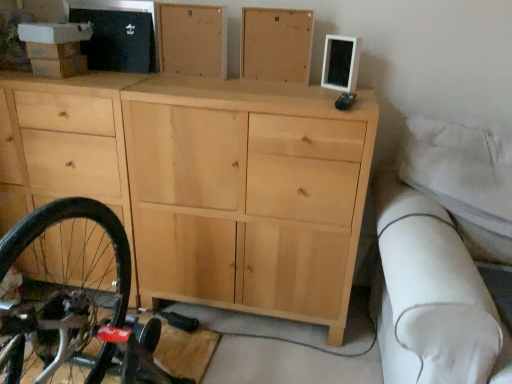
Question: Does natural wood cabinet at upper center, which is the second chest of drawer from right to left, appear on the right side of natural wood cabinet at upper center, which is counted as the 1th chest of drawer, starting from the right?

Choices:
 (A) no
 (B) yes

Answer: (A)

Question: Does natural wood cabinet at upper center, which ranks as the first chest of drawer in left-to-right order, have a greater height compared to natural wood cabinet at upper center, which is the second chest of drawer in left-to-right order?

Choices:
 (A) no
 (B) yes

Answer: (A)

Question: From a real-world perspective, is natural wood cabinet at upper center, which ranks as the first chest of drawer in left-to-right order, positioned under natural wood cabinet at upper center, which is the second chest of drawer in left-to-right order, based on gravity?

Choices:
 (A) yes
 (B) no

Answer: (B)

Question: Considering the relative sizes of natural wood cabinet at upper center, which is the second chest of drawer from right to left, and natural wood cabinet at upper center, which is counted as the 1th chest of drawer, starting from the right, in the image provided, is natural wood cabinet at upper center, which is the second chest of drawer from right to left, shorter than natural wood cabinet at upper center, which is counted as the 1th chest of drawer, starting from the right,?

Choices:
 (A) no
 (B) yes

Answer: (B)

Question: Is natural wood cabinet at upper center, which is the second chest of drawer from right to left, facing away from natural wood cabinet at upper center, which is the second chest of drawer in left-to-right order?

Choices:
 (A) no
 (B) yes

Answer: (A)

Question: Is natural wood cabinet at center wider or thinner than natural wood cabinet at upper center, which is the second chest of drawer from right to left?

Choices:
 (A) thin
 (B) wide

Answer: (B)

Question: From their relative heights in the image, would you say natural wood cabinet at center is taller or shorter than natural wood cabinet at upper center, which is the second chest of drawer from right to left?

Choices:
 (A) short
 (B) tall

Answer: (B)

Question: Is natural wood cabinet at center in front of or behind natural wood cabinet at upper center, which ranks as the first chest of drawer in left-to-right order, in the image?

Choices:
 (A) front
 (B) behind

Answer: (A)

Question: From the image's perspective, is natural wood cabinet at center positioned above or below natural wood cabinet at upper center, which ranks as the first chest of drawer in left-to-right order?

Choices:
 (A) below
 (B) above

Answer: (A)

Question: Considering the positions of natural wood cabinet at upper center, which ranks as the first chest of drawer in left-to-right order, and natural wood cabinet at center in the image, is natural wood cabinet at upper center, which ranks as the first chest of drawer in left-to-right order, wider or thinner than natural wood cabinet at center?

Choices:
 (A) wide
 (B) thin

Answer: (B)

Question: Based on their sizes in the image, would you say natural wood cabinet at upper center, which ranks as the first chest of drawer in left-to-right order, is bigger or smaller than natural wood cabinet at center?

Choices:
 (A) small
 (B) big

Answer: (A)

Question: Does point (192, 54) appear closer or farther from the camera than point (8, 129)?

Choices:
 (A) farther
 (B) closer

Answer: (A)

Question: From the image's perspective, relative to natural wood cabinet at center, is natural wood cabinet at upper center, which is the second chest of drawer from right to left, above or below?

Choices:
 (A) below
 (B) above

Answer: (B)

Question: Do you think natural wood cabinet at upper center, which is counted as the 1th chest of drawer, starting from the right, is within natural wood cabinet at upper center, which is the second chest of drawer from right to left, or outside of it?

Choices:
 (A) inside
 (B) outside

Answer: (B)

Question: From a real-world perspective, is natural wood cabinet at upper center, which is counted as the 1th chest of drawer, starting from the right, physically located above or below natural wood cabinet at upper center, which is the second chest of drawer from right to left?

Choices:
 (A) above
 (B) below

Answer: (B)